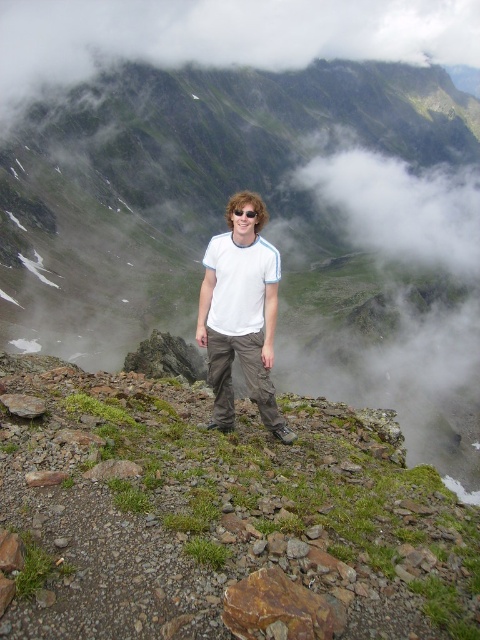
Which is in front, point (405, 168) or point (272, 387)?

Point (272, 387) is in front.

Does green mossy rock at center appear under white cotton t-shirt at center?

Incorrect, green mossy rock at center is not positioned below white cotton t-shirt at center.

You are a GUI agent. You are given a task and a screenshot of the screen. Output one action in this format:
    pyautogui.click(x=<x>, y=<y>)
    Task: Click on the green mossy rock at center
    This screenshot has width=480, height=640.
    Given the screenshot: What is the action you would take?
    pyautogui.click(x=267, y=227)

Between green mossy rocks at center and white cotton t-shirt at center, which one appears on the left side from the viewer's perspective?

From the viewer's perspective, green mossy rocks at center appears more on the left side.

Is green mossy rocks at center shorter than white cotton t-shirt at center?

Yes, green mossy rocks at center is shorter than white cotton t-shirt at center.

Describe the element at coordinates (217, 513) in the screenshot. I see `green mossy rocks at center` at that location.

Locate an element on the screen. The height and width of the screenshot is (640, 480). green mossy rocks at center is located at coordinates (217, 513).

Between green mossy rock at center and green mossy rocks at center, which one is positioned higher?

green mossy rock at center is above.

Who is taller, green mossy rock at center or green mossy rocks at center?

With more height is green mossy rock at center.

Is point (15, 268) positioned after point (444, 568)?

Yes, point (15, 268) is farther from viewer.

Image resolution: width=480 pixels, height=640 pixels. In order to click on green mossy rock at center in this screenshot , I will do [x=267, y=227].